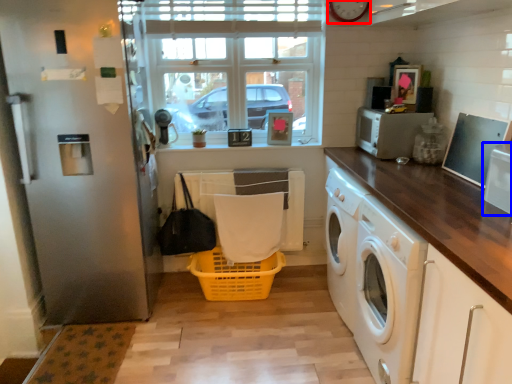
Question: Which of the following is the farthest to the observer, clock (highlighted by a red box) or appliance (highlighted by a blue box)?

Choices:
 (A) clock
 (B) appliance

Answer: (A)